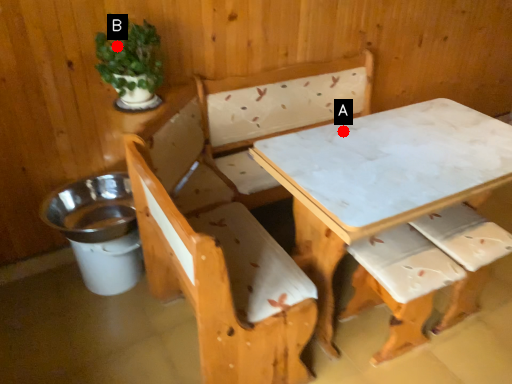
Question: Two points are circled on the image, labeled by A and B beside each circle. Which point is closer to the camera taking this photo?

Choices:
 (A) A is closer
 (B) B is closer

Answer: (B)